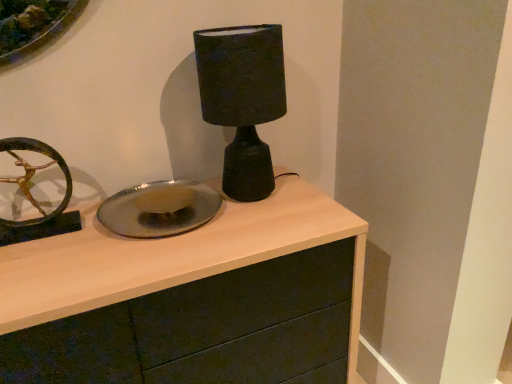
Where is `vacant space underneath shiny metallic plate at center (from a real-world perspective)`? This screenshot has width=512, height=384. vacant space underneath shiny metallic plate at center (from a real-world perspective) is located at coordinates (178, 214).